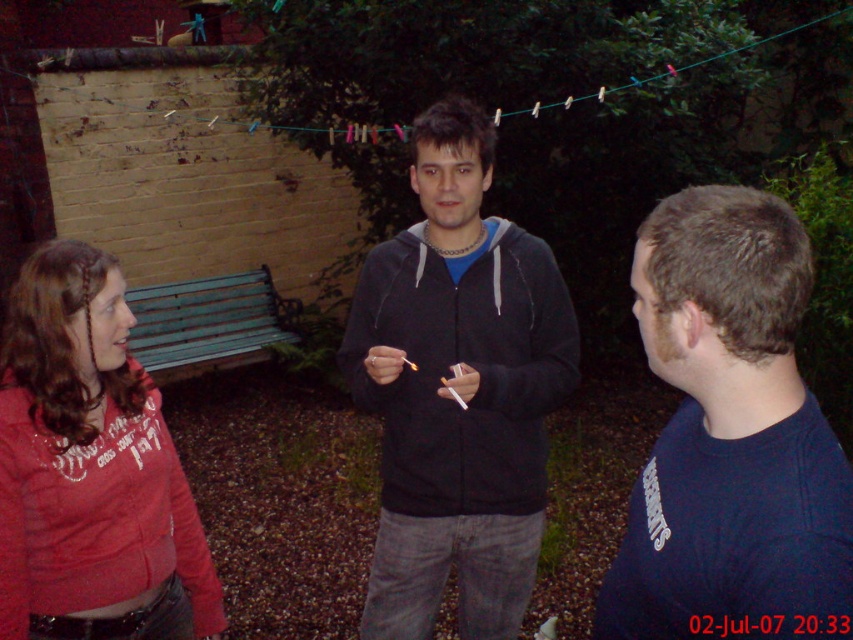
Who is positioned more to the left, dark blue sweater at right or matte red hoodie at left?

matte red hoodie at left is more to the left.

Can you confirm if dark blue sweater at right is positioned above matte red hoodie at left?

Yes.

At what (x,y) coordinates should I click in order to perform the action: click on dark blue sweater at right. Please return your answer as a coordinate pair (x, y). The height and width of the screenshot is (640, 853). Looking at the image, I should click on (730, 436).

Is dark blue sweater at right bigger than dark gray hoodie at center?

Actually, dark blue sweater at right might be smaller than dark gray hoodie at center.

At what (x,y) coordinates should I click in order to perform the action: click on dark blue sweater at right. Please return your answer as a coordinate pair (x, y). The width and height of the screenshot is (853, 640). Looking at the image, I should click on (730, 436).

Measure the distance between dark blue sweater at right and camera.

dark blue sweater at right is 34.47 inches away from camera.

Where is `dark blue sweater at right`? This screenshot has height=640, width=853. dark blue sweater at right is located at coordinates pyautogui.click(x=730, y=436).

Looking at this image, can you confirm if dark gray hoodie at center is positioned above matte red hoodie at left?

Indeed, dark gray hoodie at center is positioned over matte red hoodie at left.

Which is in front, point (492, 616) or point (206, 609)?

Point (206, 609) is more forward.

Based on the photo, who is more forward, (554, 376) or (70, 582)?

Point (70, 582) is more forward.

Identify the location of dark gray hoodie at center. (457, 390).